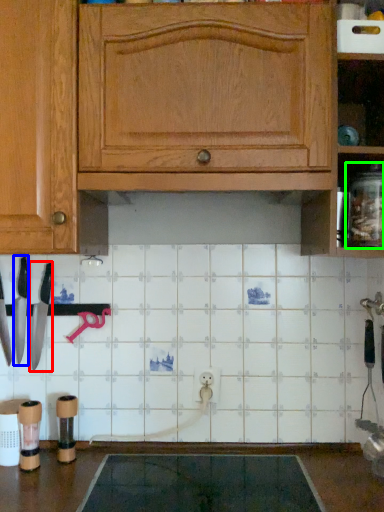
Question: Which object is the closest to the knife (highlighted by a red box)? Choose among these: knife (highlighted by a blue box) or glass jar (highlighted by a green box).

Choices:
 (A) knife
 (B) glass jar

Answer: (A)